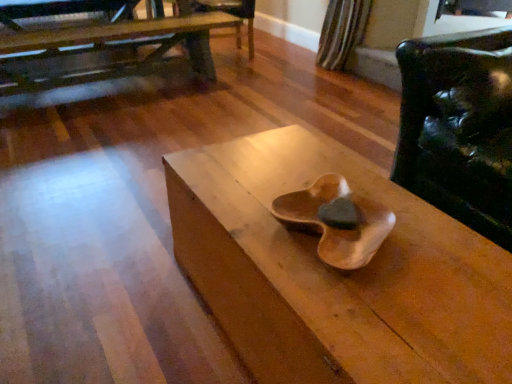
Where is `vacant region in front of wooden armchair at center`? Image resolution: width=512 pixels, height=384 pixels. vacant region in front of wooden armchair at center is located at coordinates (252, 75).